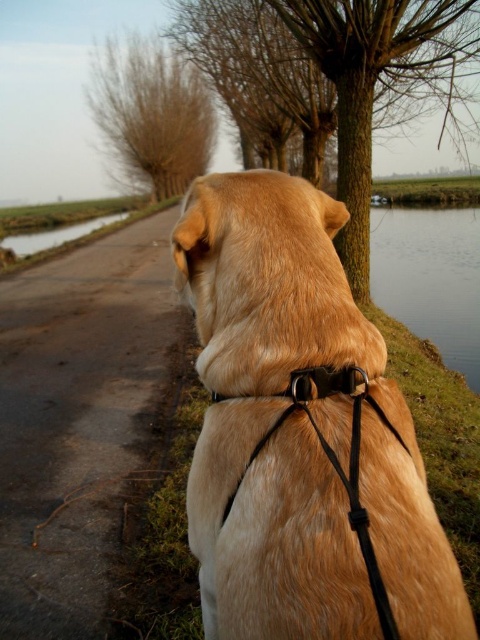
Can you confirm if clear water at right is wider than green grassy waterway at left?

Indeed, clear water at right has a greater width compared to green grassy waterway at left.

Between clear water at right and green grassy waterway at left, which one is positioned higher?

green grassy waterway at left is above.

Is point (458, 301) closer to viewer compared to point (24, 248)?

Yes, point (458, 301) is in front of point (24, 248).

Identify the location of clear water at right. The height and width of the screenshot is (640, 480). (431, 278).

Which of these two, golden fur dog at center or bare branches at upper left, stands taller?

Standing taller between the two is bare branches at upper left.

Does point (228, 424) come behind point (132, 88)?

No, it is in front of (132, 88).

This screenshot has width=480, height=640. I want to click on golden fur dog at center, so click(x=300, y=435).

Which is in front, point (302, 268) or point (333, 376)?

Positioned in front is point (333, 376).

Who is lower down, golden fur dog at center or black leather neckband at center?

Positioned lower is golden fur dog at center.

The image size is (480, 640). What are the coordinates of `golden fur dog at center` in the screenshot? It's located at (300, 435).